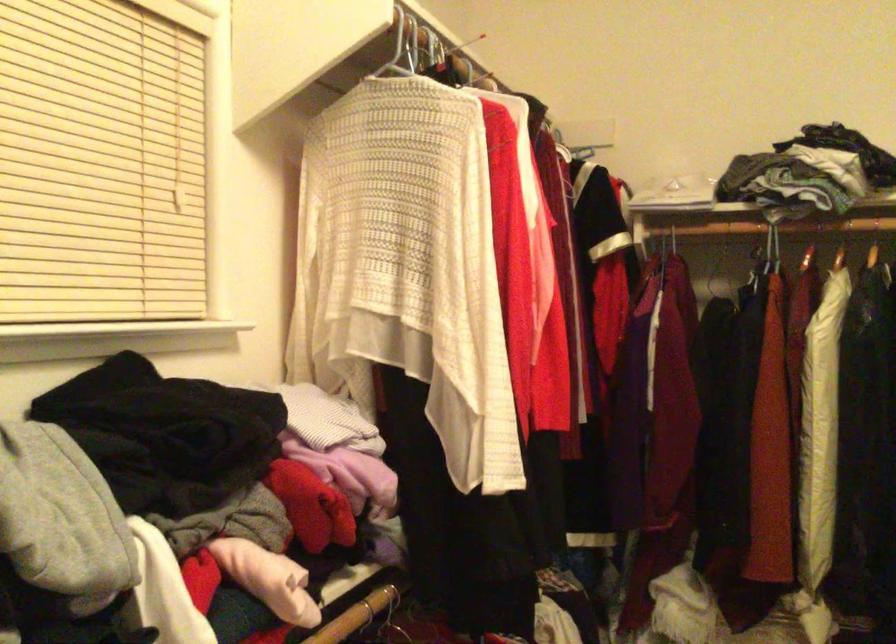
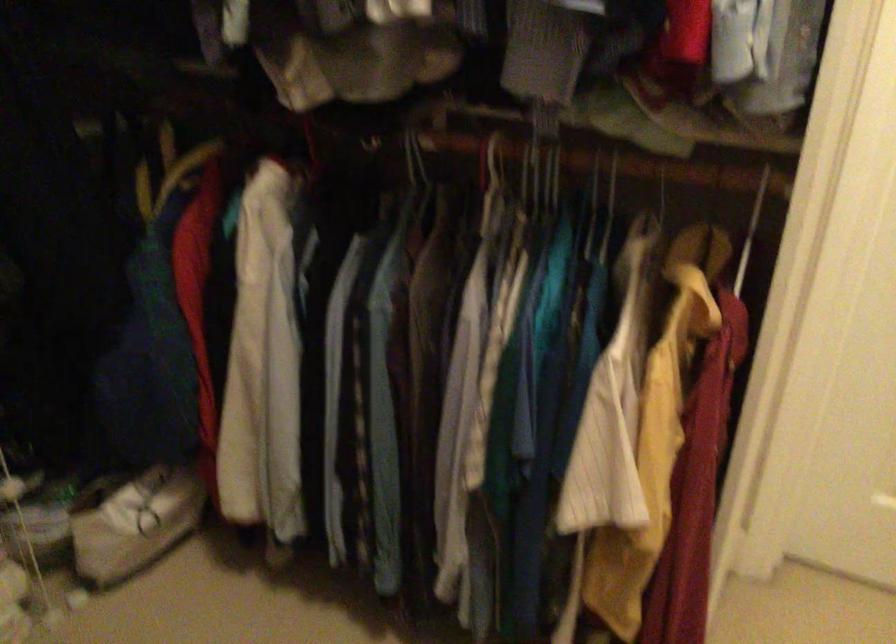
How did the camera likely rotate?

The camera rotated toward right-down.